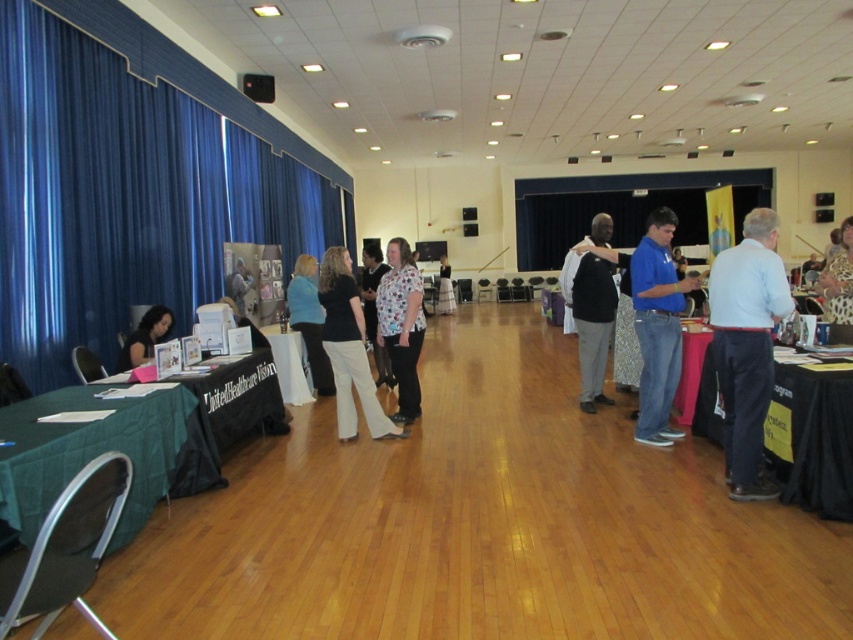
Is blue fabric curtain at left taller than light blue shirt at right?

Yes, blue fabric curtain at left is taller than light blue shirt at right.

Which of these two, blue fabric curtain at left or light blue shirt at right, stands taller?

Standing taller between the two is blue fabric curtain at left.

Which is behind, point (33, 314) or point (726, 312)?

Positioned behind is point (33, 314).

The width and height of the screenshot is (853, 640). In order to click on blue fabric curtain at left in this screenshot , I will do `click(120, 195)`.

Does point (157, 337) come behind point (448, 262)?

That is False.

The image size is (853, 640). What do you see at coordinates (144, 337) in the screenshot?
I see `matte black laptop at left` at bounding box center [144, 337].

Find the location of a particular element. This screenshot has width=853, height=640. matte black laptop at left is located at coordinates (144, 337).

Does green fabric table at left have a smaller size compared to white cotton dress at center?

Yes.

Does green fabric table at left appear on the right side of white cotton dress at center?

No, green fabric table at left is not to the right of white cotton dress at center.

Is point (207, 390) positioned behind point (440, 310)?

No.

Identify the location of green fabric table at left. (236, 401).